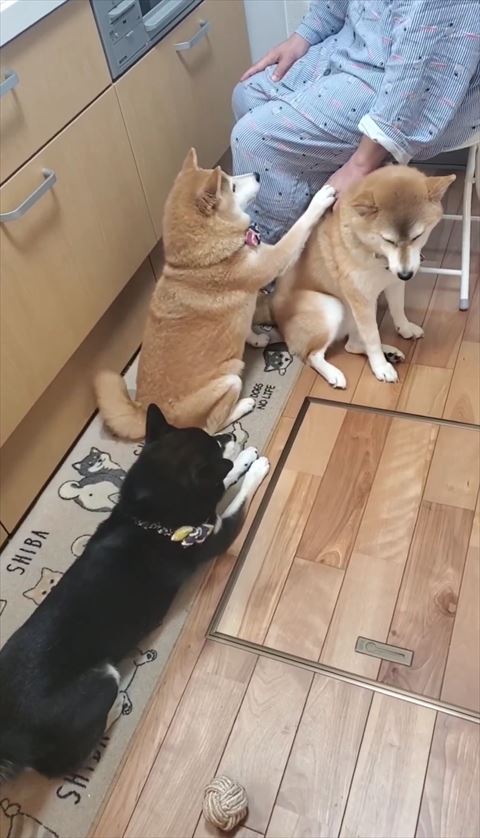
This screenshot has height=838, width=480. I want to click on metal seam on floor, so click(x=391, y=694), click(x=269, y=483), click(x=411, y=414).